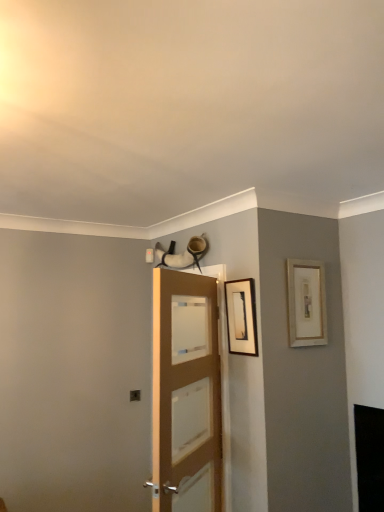
Question: Considering the relative positions of light brown wooden door at center and gold-framed picture at upper right, which is counted as the 1th picture frame, starting from the right, in the image provided, is light brown wooden door at center to the left of gold-framed picture at upper right, which is counted as the 1th picture frame, starting from the right, from the viewer's perspective?

Choices:
 (A) yes
 (B) no

Answer: (A)

Question: Can we say light brown wooden door at center lies outside gold-framed picture at upper right, which is counted as the 1th picture frame, starting from the right?

Choices:
 (A) yes
 (B) no

Answer: (A)

Question: From the image's perspective, is light brown wooden door at center located above gold-framed picture at upper right, which is counted as the 1th picture frame, starting from the right?

Choices:
 (A) no
 (B) yes

Answer: (A)

Question: Is light brown wooden door at center not close to gold-framed picture at upper right, the second picture frame when ordered from left to right?

Choices:
 (A) no
 (B) yes

Answer: (A)

Question: Considering the relative sizes of light brown wooden door at center and gold-framed picture at upper right, which is counted as the 1th picture frame, starting from the right, in the image provided, is light brown wooden door at center thinner than gold-framed picture at upper right, which is counted as the 1th picture frame, starting from the right,?

Choices:
 (A) yes
 (B) no

Answer: (B)

Question: From the image's perspective, is gold-framed picture at upper right, which is counted as the 1th picture frame, starting from the right, above or below light brown wooden door at center?

Choices:
 (A) below
 (B) above

Answer: (B)

Question: Is gold-framed picture at upper right, which is counted as the 1th picture frame, starting from the right, inside or outside of light brown wooden door at center?

Choices:
 (A) inside
 (B) outside

Answer: (B)

Question: From a real-world perspective, is gold-framed picture at upper right, which is counted as the 1th picture frame, starting from the right, above or below light brown wooden door at center?

Choices:
 (A) above
 (B) below

Answer: (A)

Question: Is gold-framed picture at upper right, the second picture frame when ordered from left to right, in front of or behind light brown wooden door at center in the image?

Choices:
 (A) front
 (B) behind

Answer: (B)

Question: From the image's perspective, relative to gold-framed picture at upper right, which is counted as the 1th picture frame, starting from the right, is light brown wooden door at center above or below?

Choices:
 (A) above
 (B) below

Answer: (B)

Question: Is light brown wooden door at center inside or outside of gold-framed picture at upper right, which is counted as the 1th picture frame, starting from the right?

Choices:
 (A) inside
 (B) outside

Answer: (B)

Question: Is light brown wooden door at center to the left or to the right of gold-framed picture at upper right, the second picture frame when ordered from left to right, in the image?

Choices:
 (A) left
 (B) right

Answer: (A)

Question: From a real-world perspective, is light brown wooden door at center positioned above or below gold-framed picture at upper right, which is counted as the 1th picture frame, starting from the right?

Choices:
 (A) below
 (B) above

Answer: (A)

Question: From a real-world perspective, relative to matte black picture frame at upper center, which is counted as the 2th picture frame, starting from the right, is gold-framed picture at upper right, which is counted as the 1th picture frame, starting from the right, vertically above or below?

Choices:
 (A) above
 (B) below

Answer: (A)

Question: In terms of width, does gold-framed picture at upper right, which is counted as the 1th picture frame, starting from the right, look wider or thinner when compared to matte black picture frame at upper center, which is counted as the 2th picture frame, starting from the right?

Choices:
 (A) wide
 (B) thin

Answer: (B)